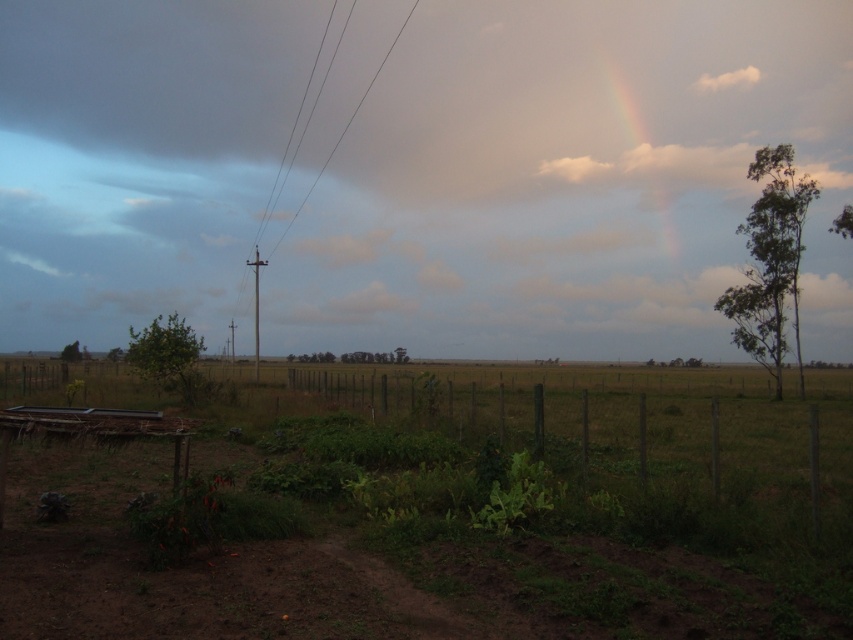
You are a photographer planning to capture the green wire fence at center and the white fluffy cloud at upper right in the same frame. Which object will appear bigger in your photo?

The green wire fence at center will appear bigger in the photo because it is larger in size than the white fluffy cloud at upper right.

You are standing in the rural landscape shown in the image and want to locate the green wire fence at center. According to the coordinates provided, where exactly should you look to find it?

The green wire fence at center is located at the 2D coordinates point (666, 436), so you should look towards that point to find it.

You are a drone operator who needs to fly a drone from the green wire fence at center to the white fluffy cloud at upper right. According to the image, what is the approximate distance you need to cover?

The green wire fence at center and white fluffy cloud at upper right are 107.87 meters apart, so the approximate distance you need to cover is 107.87 meters.